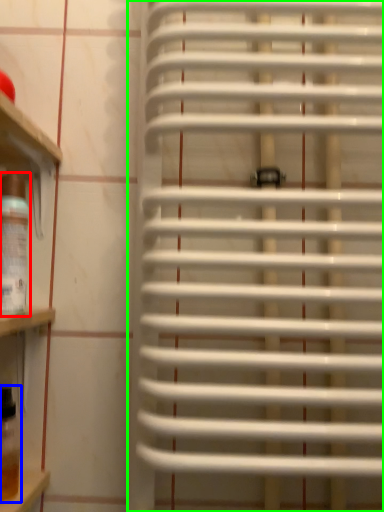
Question: Based on their relative distances, which object is farther from wine bottle (highlighted by a red box)? Choose from wine bottle (highlighted by a blue box) and window blind (highlighted by a green box).

Choices:
 (A) wine bottle
 (B) window blind

Answer: (B)